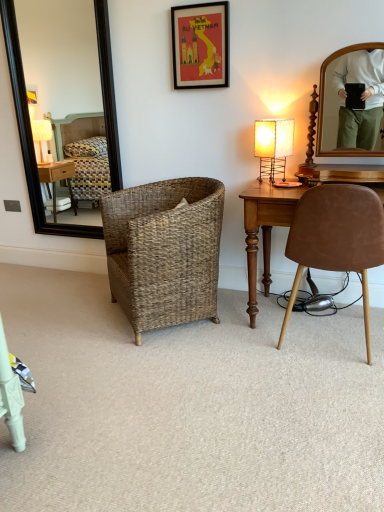
Find the location of a particular element. This screenshot has width=384, height=512. vacant space situated on the left part of brown suede chair at right, the 2th chair when ordered from left to right is located at coordinates (250, 353).